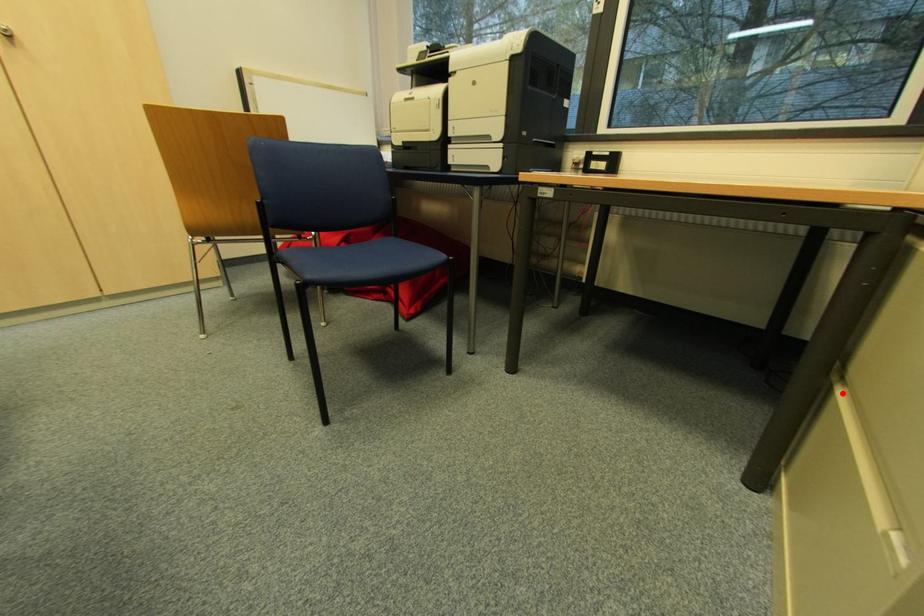
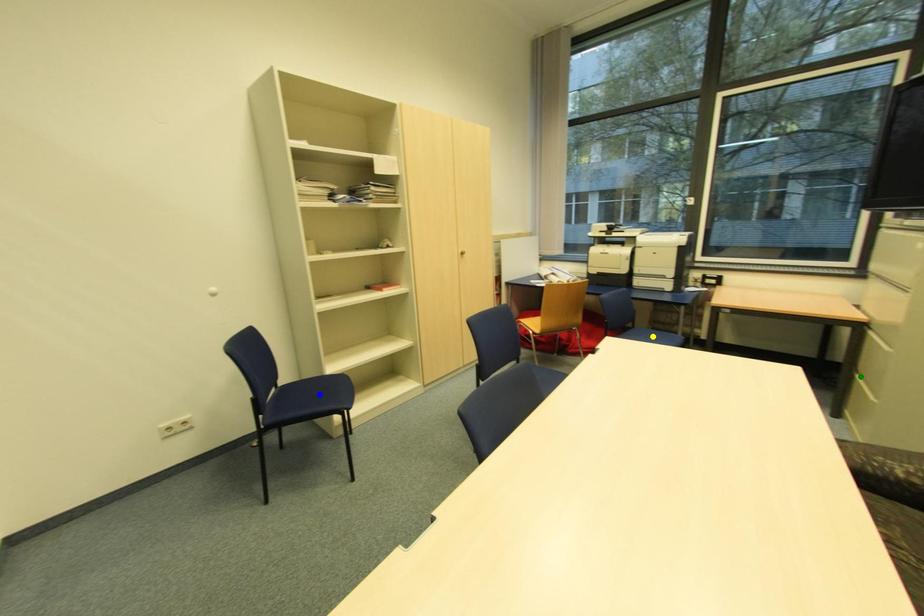
Question: I am providing you with two images of the same scene from different viewpoints. A red point is marked on the first image. You are given multiple points on the second image. Can you choose the point in image 2 that corresponds to the point in image 1?

Choices:
 (A) green point
 (B) blue point
 (C) yellow point

Answer: (A)